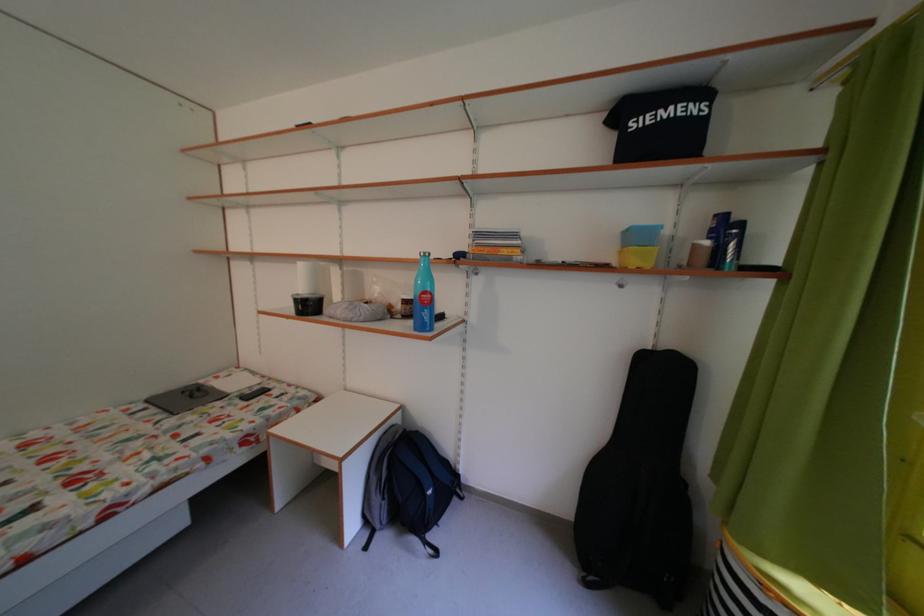
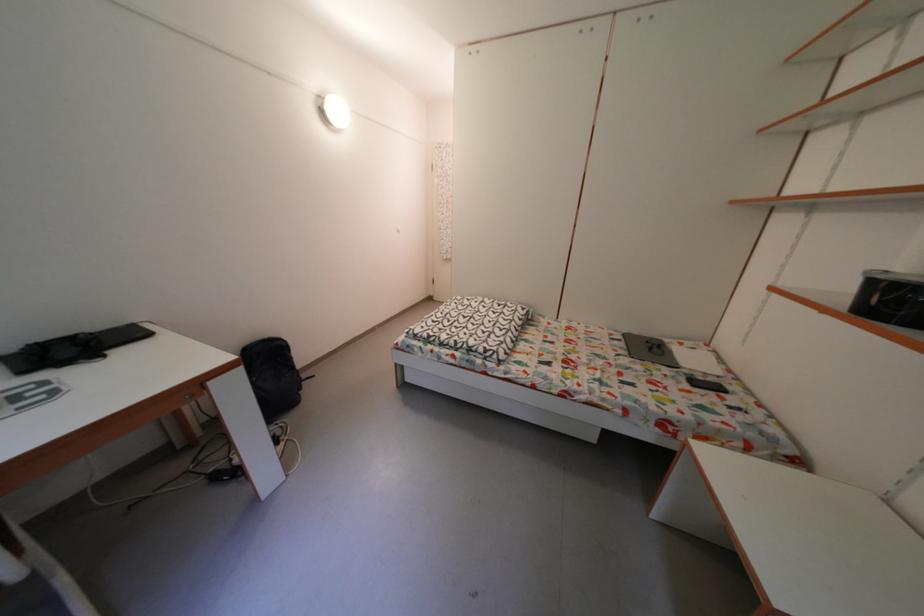
Where in the second image is the point corresponding to (153,411) from the first image?

(629, 342)